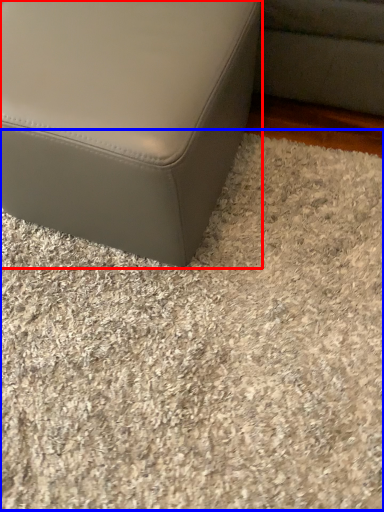
Question: Which point is further to the camera, furniture (highlighted by a red box) or gravel (highlighted by a blue box)?

Choices:
 (A) furniture
 (B) gravel

Answer: (B)